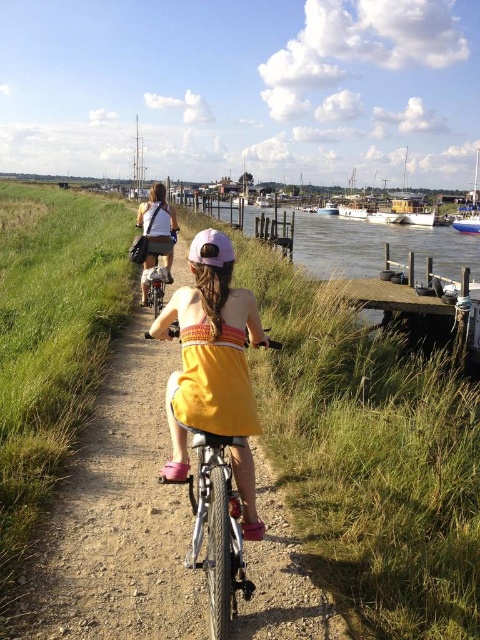
Question: Based on their relative distances, which object is nearer to the yellow cotton dress at center?

Choices:
 (A) orange cotton dress at center
 (B) white wooden boat at center

Answer: (A)

Question: Does green grass at left have a lesser width compared to white wooden boat at center?

Choices:
 (A) no
 (B) yes

Answer: (A)

Question: Which point is closer to the camera taking this photo?

Choices:
 (A) (348, 525)
 (B) (347, 212)
 (C) (158, 282)
 (D) (233, 372)

Answer: (D)

Question: Considering the relative positions of silver metallic bicycle at center and purple matte bicycle helmet at center in the image provided, where is silver metallic bicycle at center located with respect to purple matte bicycle helmet at center?

Choices:
 (A) right
 (B) left

Answer: (B)

Question: Among these objects, which one is farthest from the camera?

Choices:
 (A) green grass at center
 (B) white wooden boat at center
 (C) orange cotton dress at center

Answer: (B)

Question: Is yellow cotton dress at center bigger than matte white backpack at center?

Choices:
 (A) no
 (B) yes

Answer: (A)